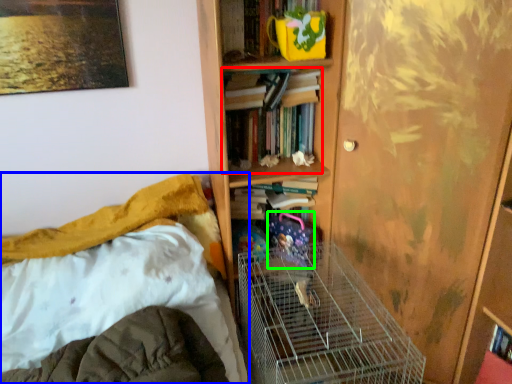
Question: Which object is positioned closest to book (highlighted by a red box)? Select from bed (highlighted by a blue box) and toy (highlighted by a green box).

Choices:
 (A) bed
 (B) toy

Answer: (B)